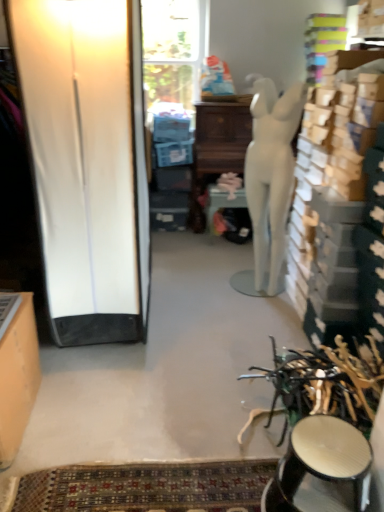
You are a GUI agent. You are given a task and a screenshot of the screen. Output one action in this format:
    pyautogui.click(x=<x>, y=<y>)
    Task: Click on the vacant space underneath white matte mannequin at center (from a real-world perspective)
    This screenshot has height=512, width=384.
    Given the screenshot: What is the action you would take?
    (x=255, y=296)